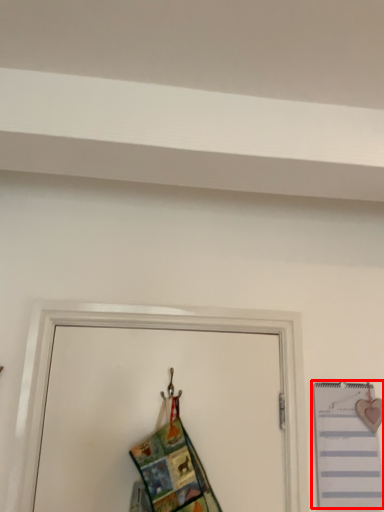
Question: Where is notebook (annotated by the red box) located in relation to fancy dress in the image?

Choices:
 (A) right
 (B) left

Answer: (A)